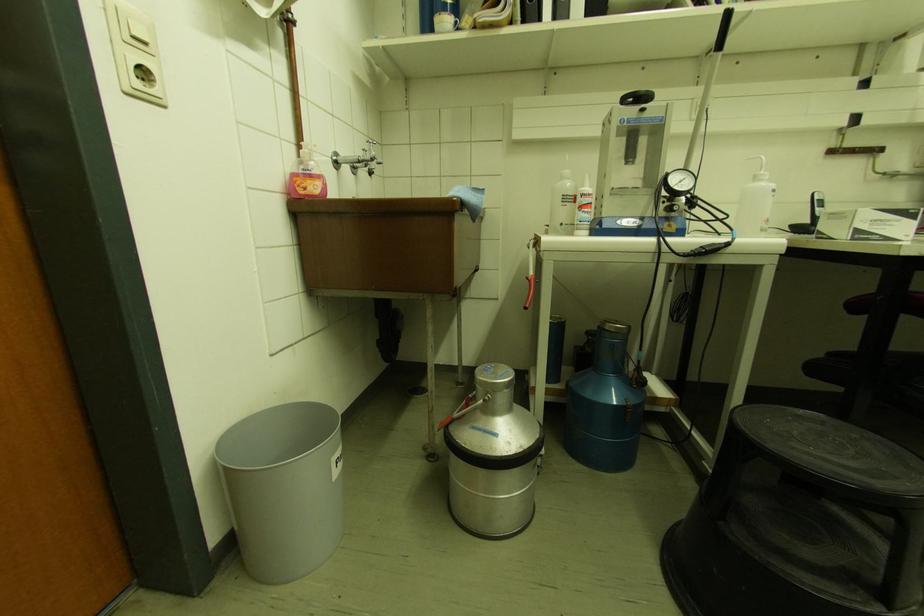
The image size is (924, 616). What do you see at coordinates (446, 421) in the screenshot?
I see `a red clamp handle` at bounding box center [446, 421].